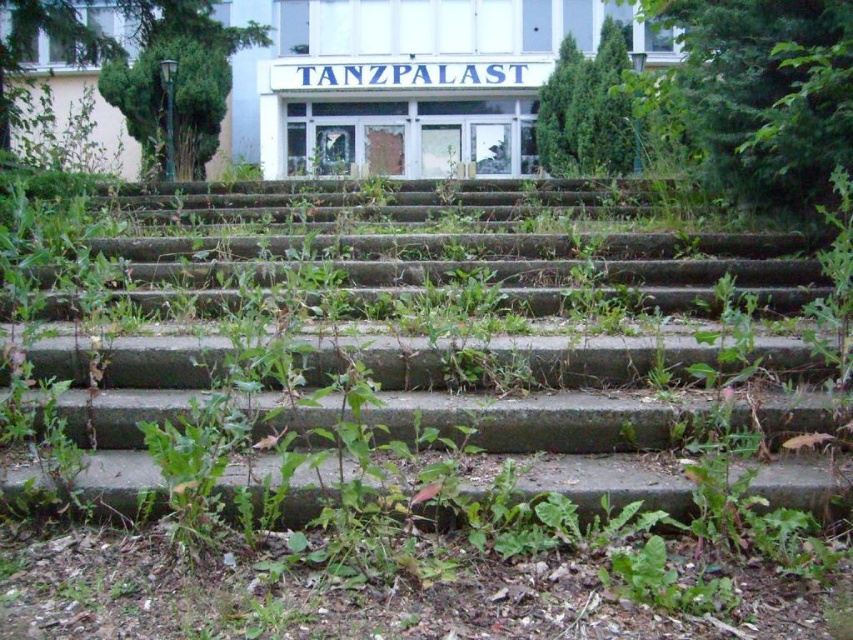
You are standing at the bottom of the weathered concrete steps leading to the Tanzpalast building. You notice two points marked on the steps. Which point is closer to you, point (65, 397) or point (569, 145)?

Point (65, 397) is closer to the camera than point (569, 145), so it is closer to you.

You are a gardener assessing the area. You need to determine which area is larger in size between the green concrete stairs at center and the green leafy shrub at upper center. Which one is larger?

The green leafy shrub at upper center is larger in size than the green concrete stairs at center because the green concrete stairs at center occupies less space than green leafy shrub at upper center.

You are a maintenance worker tasked with clearing the green leafy shrub at upper center from its current position. To access it, you need to stand on the green concrete stairs at center. Is the shrub above or below the stairs?

The green concrete stairs at center is located below the green leafy shrub at upper center, so the shrub is above the stairs.